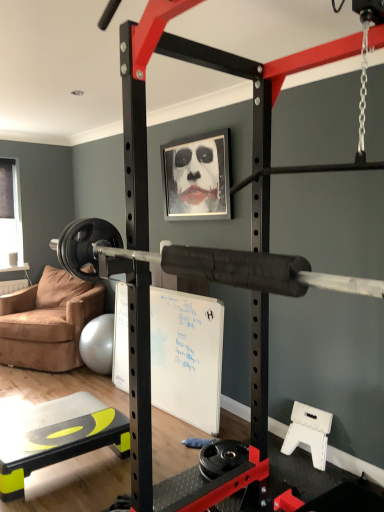
Question: Is brown suede chair at left located outside transparent plastic window screen at left?

Choices:
 (A) yes
 (B) no

Answer: (A)

Question: Is brown suede chair at left oriented away from transparent plastic window screen at left?

Choices:
 (A) no
 (B) yes

Answer: (A)

Question: Is brown suede chair at left at the left side of transparent plastic window screen at left?

Choices:
 (A) no
 (B) yes

Answer: (A)

Question: From the image's perspective, does brown suede chair at left appear higher than transparent plastic window screen at left?

Choices:
 (A) yes
 (B) no

Answer: (B)

Question: Is brown suede chair at left closer to camera compared to transparent plastic window screen at left?

Choices:
 (A) no
 (B) yes

Answer: (B)

Question: Is brown suede chair at left wider than transparent plastic window screen at left?

Choices:
 (A) yes
 (B) no

Answer: (A)

Question: From the image's perspective, would you say yellow-green plastic step at lower left is positioned over metallic silver picture frame at upper center?

Choices:
 (A) no
 (B) yes

Answer: (A)

Question: From the image's perspective, does yellow-green plastic step at lower left appear lower than metallic silver picture frame at upper center?

Choices:
 (A) no
 (B) yes

Answer: (B)

Question: Is metallic silver picture frame at upper center at the back of yellow-green plastic step at lower left?

Choices:
 (A) yes
 (B) no

Answer: (B)

Question: Considering the relative sizes of yellow-green plastic step at lower left and metallic silver picture frame at upper center in the image provided, is yellow-green plastic step at lower left smaller than metallic silver picture frame at upper center?

Choices:
 (A) yes
 (B) no

Answer: (B)

Question: From a real-world perspective, does yellow-green plastic step at lower left stand above metallic silver picture frame at upper center?

Choices:
 (A) yes
 (B) no

Answer: (B)

Question: Are yellow-green plastic step at lower left and metallic silver picture frame at upper center making contact?

Choices:
 (A) no
 (B) yes

Answer: (A)

Question: Is yellow-green plastic step at lower left taller than brown suede chair at left?

Choices:
 (A) yes
 (B) no

Answer: (B)